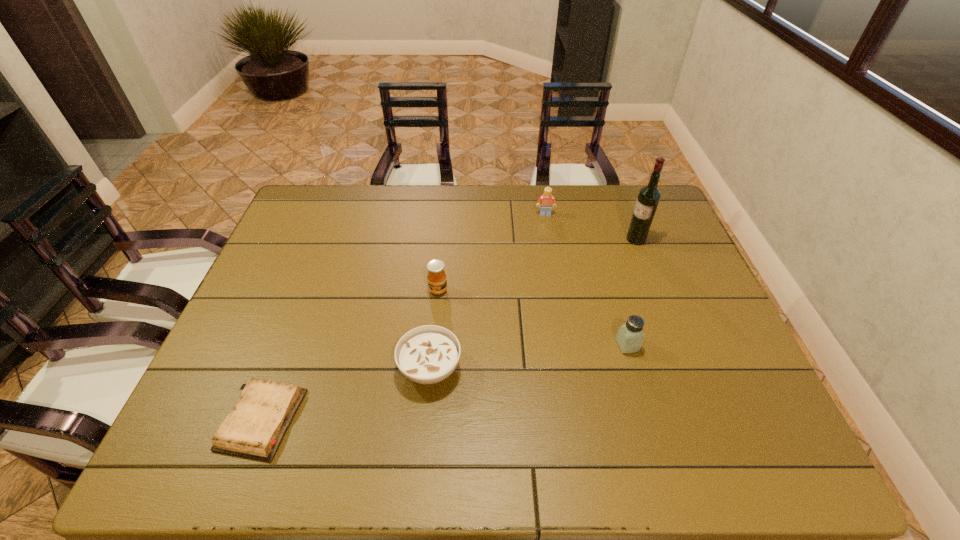
You are a GUI agent. You are given a task and a screenshot of the screen. Output one action in this format:
    pyautogui.click(x=<x>, y=<y>)
    Task: Click on the fifth nearest object
    This screenshot has height=540, width=960.
    Given the screenshot: What is the action you would take?
    pyautogui.click(x=649, y=196)

You are a GUI agent. You are given a task and a screenshot of the screen. Output one action in this format:
    pyautogui.click(x=<x>, y=<y>)
    Task: Click on the rightmost object
    This screenshot has width=960, height=540.
    Given the screenshot: What is the action you would take?
    pyautogui.click(x=649, y=196)

You are a GUI agent. You are given a task and a screenshot of the screen. Output one action in this format:
    pyautogui.click(x=<x>, y=<y>)
    Task: Click on the fourth object from left to right
    The width and height of the screenshot is (960, 540).
    Given the screenshot: What is the action you would take?
    pyautogui.click(x=547, y=200)

At what (x,y) coordinates should I click in order to perform the action: click on the farthest object. Please return your answer as a coordinate pair (x, y). Looking at the image, I should click on (547, 200).

Locate an element on the screen. This screenshot has height=540, width=960. the third farthest object is located at coordinates (437, 282).

Image resolution: width=960 pixels, height=540 pixels. Find the location of `saltshaker`. saltshaker is located at coordinates (630, 336).

The width and height of the screenshot is (960, 540). In order to click on the second shortest object in this screenshot , I will do `click(428, 354)`.

Image resolution: width=960 pixels, height=540 pixels. Identify the location of the shortest object. (254, 429).

Locate an element on the screen. Image resolution: width=960 pixels, height=540 pixels. the leftmost object is located at coordinates 254,429.

Find the location of a particular element. The width and height of the screenshot is (960, 540). free location located 0.090m on the front and back of the fifth nearest object is located at coordinates (598, 239).